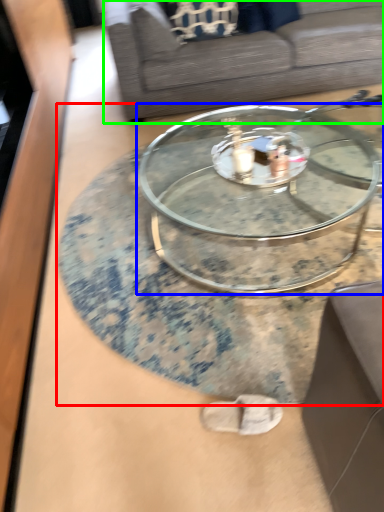
Question: Which is nearer to the coffee table (highlighted by a red box)? coffee table (highlighted by a blue box) or studio couch (highlighted by a green box).

Choices:
 (A) coffee table
 (B) studio couch

Answer: (A)